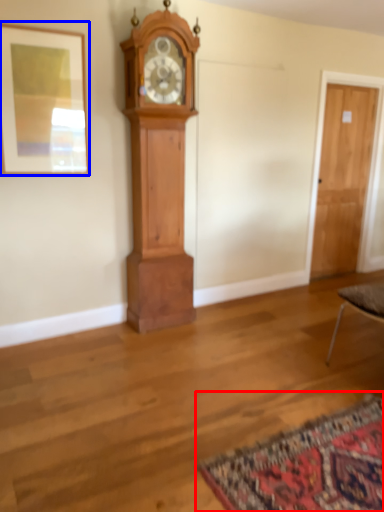
Question: Which object is closer to the camera taking this photo, mat (highlighted by a red box) or picture frame (highlighted by a blue box)?

Choices:
 (A) mat
 (B) picture frame

Answer: (A)